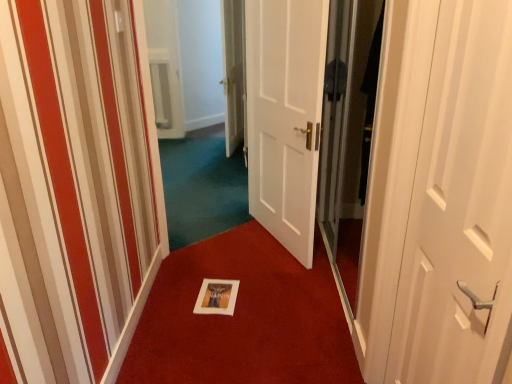
In the scene shown: What is the approximate width of white matte door at center, which appears as the 2th door when viewed from the left?

white matte door at center, which appears as the 2th door when viewed from the left, is 3.35 inches in width.

Image resolution: width=512 pixels, height=384 pixels. What do you see at coordinates (285, 116) in the screenshot? I see `white matte door at center, placed as the second door when sorted from front to back` at bounding box center [285, 116].

Identify the location of white glossy door at center, which ranks as the 1th door in left-to-right order. (233, 72).

How much distance is there between white paper at center and white glossy door at center, which ranks as the 1th door in left-to-right order?

They are 1.33 meters apart.

Which is closer, (191, 253) or (226, 11)?

The point (191, 253) is closer to the camera.

Which is more to the left, white paper at center or white glossy door at center, which is the 1th door in back-to-front order?

From the viewer's perspective, white glossy door at center, which is the 1th door in back-to-front order, appears more on the left side.

Is white paper at center looking in the opposite direction of white glossy door at center, the third door viewed from the front?

That's not correct — white paper at center is not looking away from white glossy door at center, the third door viewed from the front.

Starting from the transparent glass screen door at right, which door is the 1st one to the left? Please provide its 2D coordinates.

[(285, 116)]

Between transparent glass screen door at right and white matte door at center, the 2th door when ordered from back to front, which one has less height?

white matte door at center, the 2th door when ordered from back to front.

Consider the image. Could you tell me if transparent glass screen door at right is facing white matte door at center, the 2th door when ordered from back to front?

Yes, transparent glass screen door at right faces towards white matte door at center, the 2th door when ordered from back to front.

Is transparent glass screen door at right smaller than white matte door at center, the 2th door when ordered from back to front?

Yes.

From the picture: Could you measure the distance between white matte door at center, acting as the 2th door starting from the right, and white paper at center?

white matte door at center, acting as the 2th door starting from the right, and white paper at center are 69.84 centimeters apart.

Consider the image. Is white matte door at center, placed as the second door when sorted from front to back, looking in the opposite direction of white paper at center?

white matte door at center, placed as the second door when sorted from front to back, does not have its back to white paper at center.

Based on their positions, is white matte door at center, which appears as the 2th door when viewed from the left, located to the left or right of white paper at center?

From the image, it's evident that white matte door at center, which appears as the 2th door when viewed from the left, is to the left of white paper at center.

In the scene shown: Does white matte door at center, placed as the second door when sorted from front to back, come in front of white paper at center?

No, white matte door at center, placed as the second door when sorted from front to back, is behind white paper at center.

Is white matte door at center, acting as the 2th door starting from the right, not within white glossy door at center, which is counted as the third door, starting from the right?

white matte door at center, acting as the 2th door starting from the right, lies outside white glossy door at center, which is counted as the third door, starting from the right,'s area.

From the image's perspective, between white matte door at center, which appears as the 2th door when viewed from the left, and white glossy door at center, which is counted as the third door, starting from the right, which one is located above?

white glossy door at center, which is counted as the third door, starting from the right, appears higher in the image.

Based on the photo, is white matte door at center, acting as the 2th door starting from the right, bigger than white glossy door at center, which is the 1th door in back-to-front order?

Actually, white matte door at center, acting as the 2th door starting from the right, might be smaller than white glossy door at center, which is the 1th door in back-to-front order.

Could you tell me if white matte door at center, placed as the second door when sorted from front to back, is turned towards white glossy door at center, which ranks as the 1th door in left-to-right order?

No, white matte door at center, placed as the second door when sorted from front to back, is not turned towards white glossy door at center, which ranks as the 1th door in left-to-right order.

Looking at this image, is white matte door at right, the 3th door viewed from the back, surrounding white paper at center?

No, white paper at center is not inside white matte door at right, the 3th door viewed from the back.

Is point (481, 209) positioned after point (162, 290)?

No, (481, 209) is in front of (162, 290).

Locate an element on the screen. This screenshot has width=512, height=384. doormat below the white matte door at right, positioned as the first door in front-to-back order (from a real-world perspective) is located at coordinates (243, 318).

How different are the orientations of white matte door at right, placed as the first door when sorted from right to left, and white paper at center in degrees?

The facing directions of white matte door at right, placed as the first door when sorted from right to left, and white paper at center are 90 degrees apart.

From the image's perspective, which one is positioned lower, white matte door at center, acting as the 2th door starting from the right, or transparent glass screen door at right?

transparent glass screen door at right appears lower in the image.

From a real-world perspective, relative to transparent glass screen door at right, is white matte door at center, the 2th door when ordered from back to front, vertically above or below?

white matte door at center, the 2th door when ordered from back to front, is situated higher than transparent glass screen door at right in the real world.

Is point (254, 186) positioned after point (337, 10)?

Yes.

Considering the sizes of objects white matte door at right, positioned as the first door in front-to-back order, and white matte door at center, acting as the 2th door starting from the right, in the image provided, who is shorter, white matte door at right, positioned as the first door in front-to-back order, or white matte door at center, acting as the 2th door starting from the right,?

white matte door at right, positioned as the first door in front-to-back order.

Can white matte door at center, placed as the second door when sorted from front to back, be found inside white matte door at right, which is counted as the third door, starting from the left?

No, white matte door at center, placed as the second door when sorted from front to back, is not surrounded by white matte door at right, which is counted as the third door, starting from the left.

Can you confirm if white matte door at right, the 3th door viewed from the back, is positioned to the right of white matte door at center, placed as the second door when sorted from front to back?

Yes.

The height and width of the screenshot is (384, 512). There is a white paper at center. Find the location of `the 3rd door above it (from the image's perspective)`. the 3rd door above it (from the image's perspective) is located at coordinates (233, 72).

Where is `screen door beneath the white matte door at center, which appears as the 2th door when viewed from the left (from a real-world perspective)`? screen door beneath the white matte door at center, which appears as the 2th door when viewed from the left (from a real-world perspective) is located at coordinates (348, 133).

Looking at the image, which one is located further to white matte door at right, placed as the first door when sorted from right to left, transparent glass screen door at right or white paper at center?

The object further to white matte door at right, placed as the first door when sorted from right to left, is white paper at center.

From the image, which object appears to be nearer to white matte door at right, the 3th door viewed from the back, white matte door at center, acting as the 2th door starting from the right, or white paper at center?

white paper at center is positioned closer to the anchor white matte door at right, the 3th door viewed from the back.

When comparing their distances from transparent glass screen door at right, does white glossy door at center, which ranks as the 1th door in left-to-right order, or white matte door at right, the 3th door viewed from the back, seem closer?

Based on the image, white glossy door at center, which ranks as the 1th door in left-to-right order, appears to be nearer to transparent glass screen door at right.

Considering their positions, is transparent glass screen door at right positioned further to white glossy door at center, which is the 1th door in back-to-front order, than white matte door at right, placed as the first door when sorted from right to left?

white matte door at right, placed as the first door when sorted from right to left, lies further to white glossy door at center, which is the 1th door in back-to-front order, than the other object.

When comparing their distances from white paper at center, does transparent glass screen door at right or white glossy door at center, the third door viewed from the front, seem further?

white glossy door at center, the third door viewed from the front.

When comparing their distances from white matte door at right, which is counted as the third door, starting from the left, does white matte door at center, placed as the second door when sorted from front to back, or transparent glass screen door at right seem closer?

transparent glass screen door at right is positioned closer to the anchor white matte door at right, which is counted as the third door, starting from the left.

Which object lies nearer to the anchor point white matte door at center, placed as the second door when sorted from front to back, white glossy door at center, which ranks as the 1th door in left-to-right order, or white matte door at right, positioned as the first door in front-to-back order?

Based on the image, white glossy door at center, which ranks as the 1th door in left-to-right order, appears to be nearer to white matte door at center, placed as the second door when sorted from front to back.

In the scene shown: From the image, which object appears to be nearer to transparent glass screen door at right, white matte door at center, acting as the 2th door starting from the right, or white paper at center?

Among the two, white matte door at center, acting as the 2th door starting from the right, is located nearer to transparent glass screen door at right.

Locate an element on the screen. Image resolution: width=512 pixels, height=384 pixels. screen door positioned between white matte door at right, positioned as the first door in front-to-back order, and white glossy door at center, which is counted as the third door, starting from the right, from near to far is located at coordinates tap(348, 133).

Where is `door between transparent glass screen door at right and white glossy door at center, which ranks as the 1th door in left-to-right order, from front to back`? The width and height of the screenshot is (512, 384). door between transparent glass screen door at right and white glossy door at center, which ranks as the 1th door in left-to-right order, from front to back is located at coordinates (285, 116).

Where is `doormat between transparent glass screen door at right and white glossy door at center, which ranks as the 1th door in left-to-right order, along the z-axis`? This screenshot has width=512, height=384. doormat between transparent glass screen door at right and white glossy door at center, which ranks as the 1th door in left-to-right order, along the z-axis is located at coordinates (243, 318).

Where is `screen door that lies between white matte door at center, acting as the 2th door starting from the right, and white paper at center from top to bottom`? screen door that lies between white matte door at center, acting as the 2th door starting from the right, and white paper at center from top to bottom is located at coordinates (348, 133).